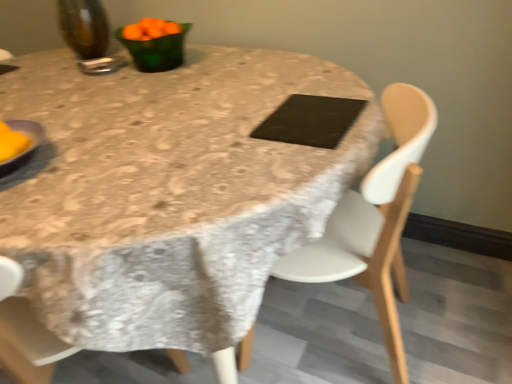
Question: In terms of width, does black matte pad at center look wider or thinner when compared to green glass bowl at upper left, the 2th tableware when ordered from left to right?

Choices:
 (A) wide
 (B) thin

Answer: (B)

Question: Is point (325, 129) positioned closer to the camera than point (159, 36)?

Choices:
 (A) farther
 (B) closer

Answer: (A)

Question: Based on their relative distances, which object is farther from the black matte pad at center?

Choices:
 (A) green glass bowl at upper left, the 2th tableware when ordered from left to right
 (B) metallic silver spoon at upper left, the second tableware in the right-to-left sequence
 (C) linen tablecloth at center
 (D) white plastic chair at center
 (E) yellow matte plate at left

Answer: (E)

Question: Estimate the real-world distances between objects in this image. Which object is closer to the black matte pad at center?

Choices:
 (A) metallic silver spoon at upper left, the second tableware in the right-to-left sequence
 (B) green glass bowl at upper left, the 2th tableware when ordered from left to right
 (C) linen tablecloth at center
 (D) yellow matte plate at left
 (E) white plastic chair at center

Answer: (C)